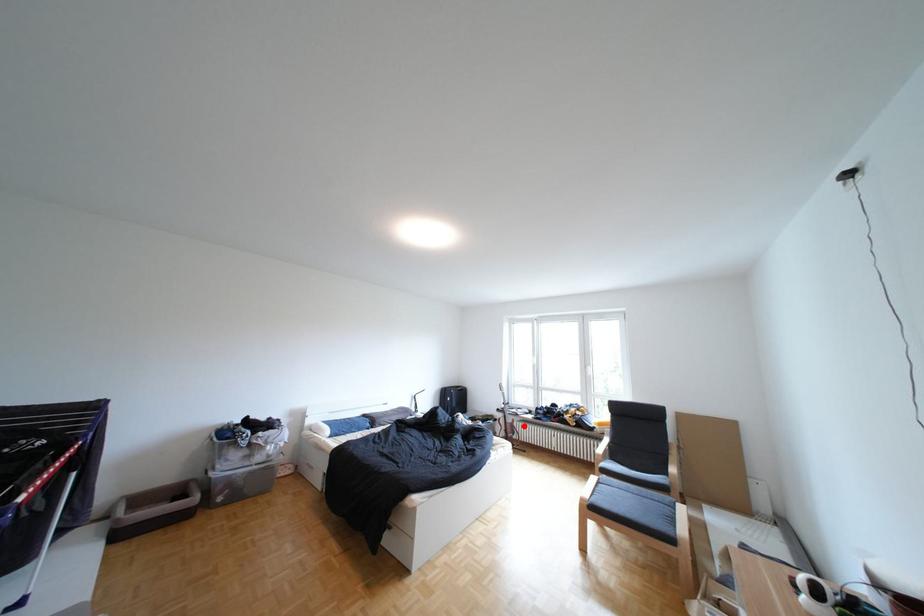
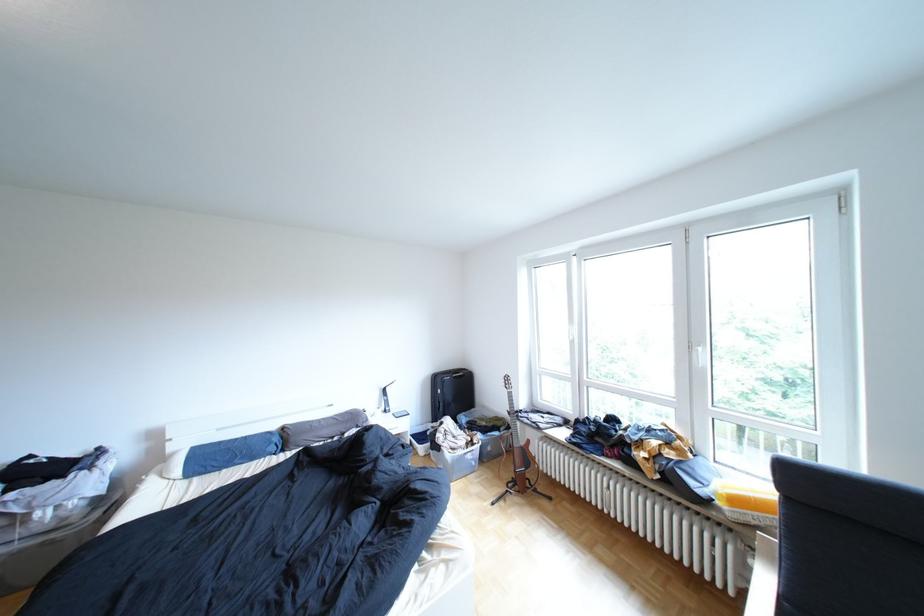
Question: I am providing you with two images of the same scene from different viewpoints. Image1 has a red point marked. In image2, the corresponding 3D location appears at what relative position? Reply with the corresponding letter.

Choices:
 (A) Closer
 (B) Farther

Answer: (A)